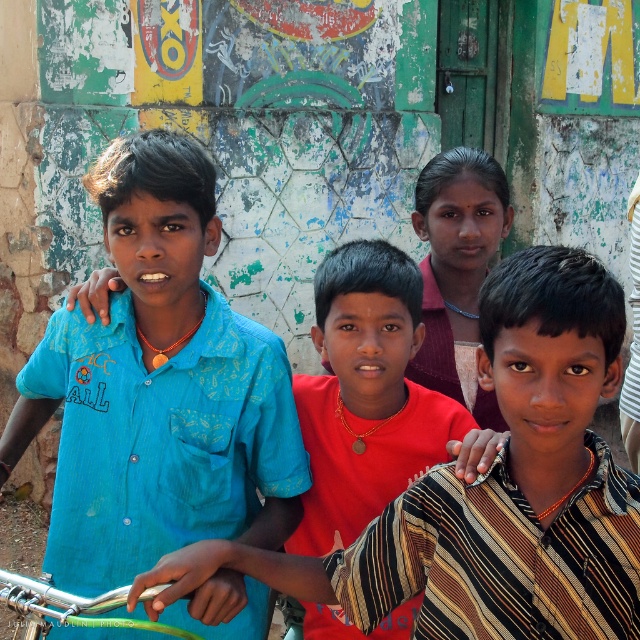
You are a photographer trying to capture the children in the scene. You notice the blue cotton shirt at left and the red matte shirt at center. Which child should you focus on if you want to highlight the one positioned higher up in the frame?

The blue cotton shirt at left is positioned higher up in the frame compared to the red matte shirt at center, so focusing on the blue cotton shirt at left would highlight the higher position.

You are a photographer trying to capture a photo of the blue cotton shirt at left and the green rubber handlebars at lower left. Which object should you focus on first if you want to ensure both are in frame without moving the camera?

The blue cotton shirt at left is positioned on the left side of green rubber handlebars at lower left, so you should focus on the blue cotton shirt at left first to ensure both are in frame without moving the camera.

You are a photographer trying to capture the two boys in the image. The blue cotton shirt at left and the red matte shirt at center are the subjects. Which boy should you focus on first if you want to start from the left side?

The blue cotton shirt at left should be focused on first since it is positioned on the left side of the red matte shirt at center.